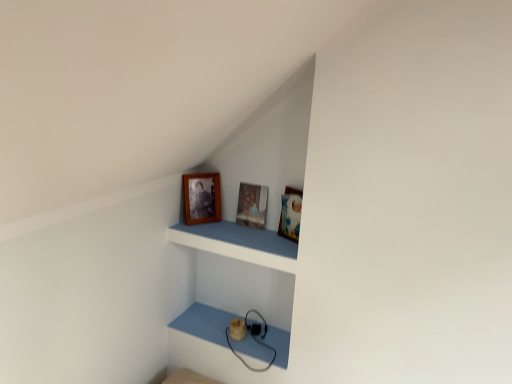
Locate an element on the screen. This screenshot has height=384, width=512. free space in front of wooden photo frame at upper center, which is counted as the second picture frame, starting from the right is located at coordinates (209, 236).